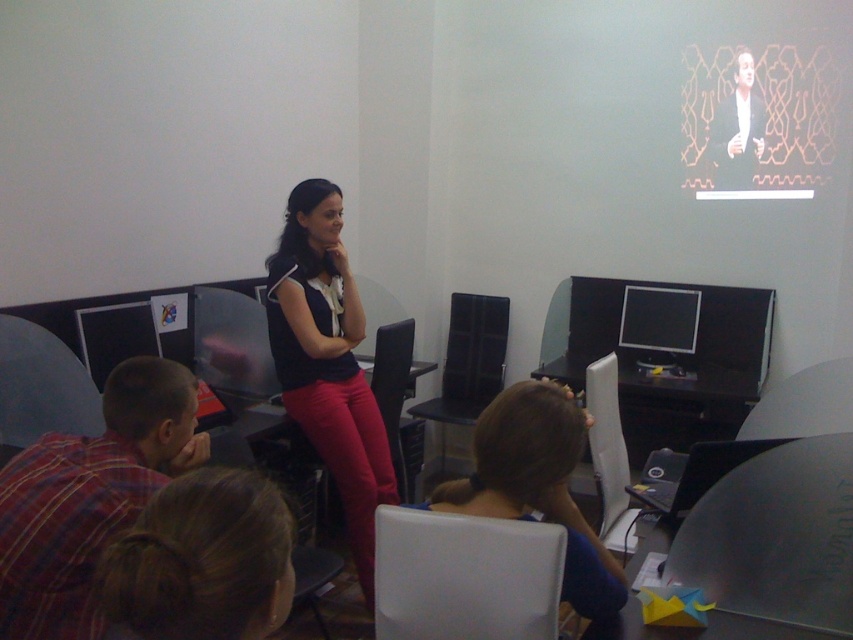
What do you see at coordinates (90, 497) in the screenshot? I see `plaid fabric shirt at lower left` at bounding box center [90, 497].

Which is below, plaid fabric shirt at lower left or matte black monitor at left?

plaid fabric shirt at lower left is below.

The width and height of the screenshot is (853, 640). Describe the element at coordinates (90, 497) in the screenshot. I see `plaid fabric shirt at lower left` at that location.

Identify the location of plaid fabric shirt at lower left. The height and width of the screenshot is (640, 853). (90, 497).

Is matte black top at center in front of matte black monitor at center right?

That is True.

Does matte black top at center appear under matte black monitor at center right?

Correct, matte black top at center is located below matte black monitor at center right.

Image resolution: width=853 pixels, height=640 pixels. Describe the element at coordinates (328, 362) in the screenshot. I see `matte black top at center` at that location.

The width and height of the screenshot is (853, 640). In order to click on matte black top at center in this screenshot , I will do `click(328, 362)`.

Is point (57, 513) farther from viewer compared to point (524, 502)?

No, it is not.

In the scene shown: Is plaid fabric shirt at lower left closer to the viewer compared to brown hair at center?

Yes, plaid fabric shirt at lower left is in front of brown hair at center.

The height and width of the screenshot is (640, 853). What do you see at coordinates (90, 497) in the screenshot?
I see `plaid fabric shirt at lower left` at bounding box center [90, 497].

You are a GUI agent. You are given a task and a screenshot of the screen. Output one action in this format:
    pyautogui.click(x=<x>, y=<y>)
    Task: Click on the plaid fabric shirt at lower left
    
    Given the screenshot: What is the action you would take?
    pyautogui.click(x=90, y=497)